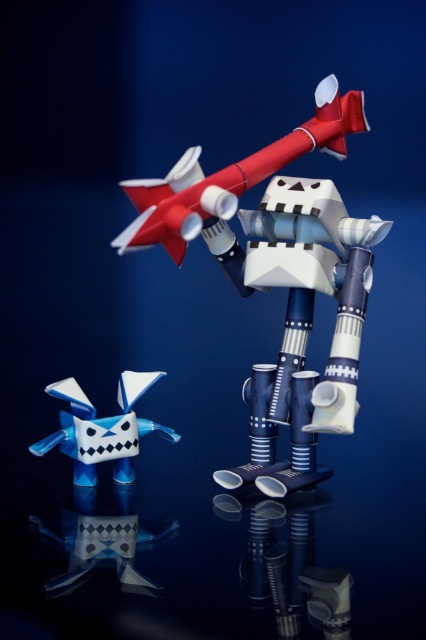
What are the coordinates of the matte plastic rocket at center?

The matte plastic rocket at center is located at point [232,177].

From the picture: You are standing in front of the two paper models. Which object is nearer to you, the matte plastic rocket at center or the translucent blue plastic toy at lower left?

Answer: The matte plastic rocket at center is closer to the viewer than the translucent blue plastic toy at lower left.